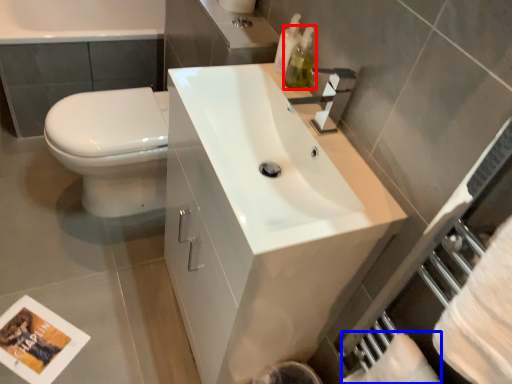
Question: Among these objects, which one is farthest to the camera, soap dispenser (highlighted by a red box) or toilet paper (highlighted by a blue box)?

Choices:
 (A) soap dispenser
 (B) toilet paper

Answer: (A)